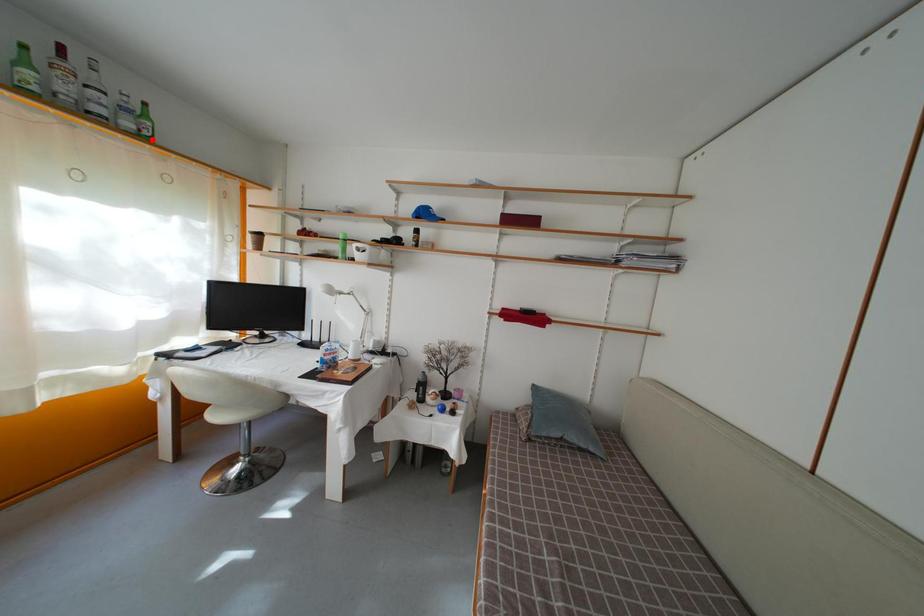
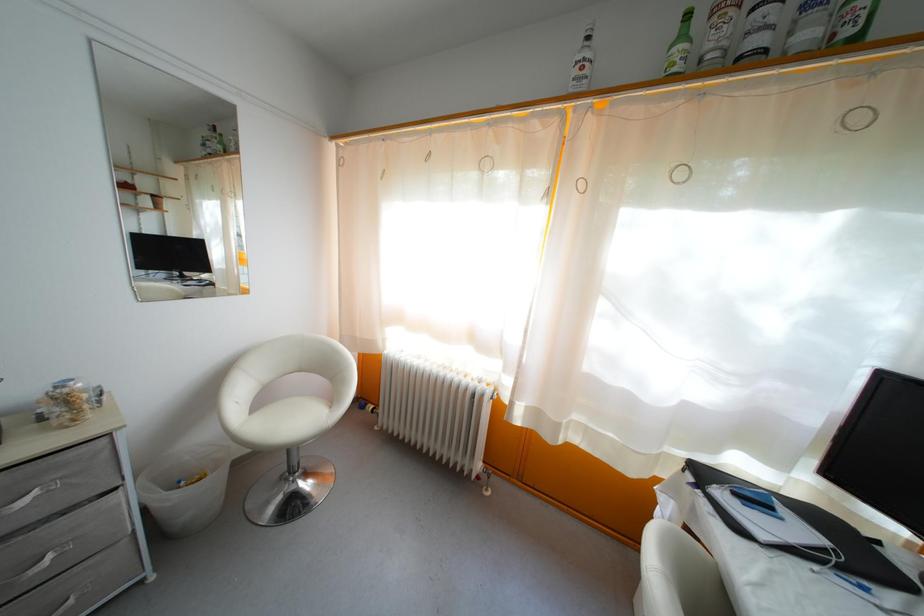
Locate, in the second image, the point that corresponds to the highlighted location in the first image.

(854, 39)